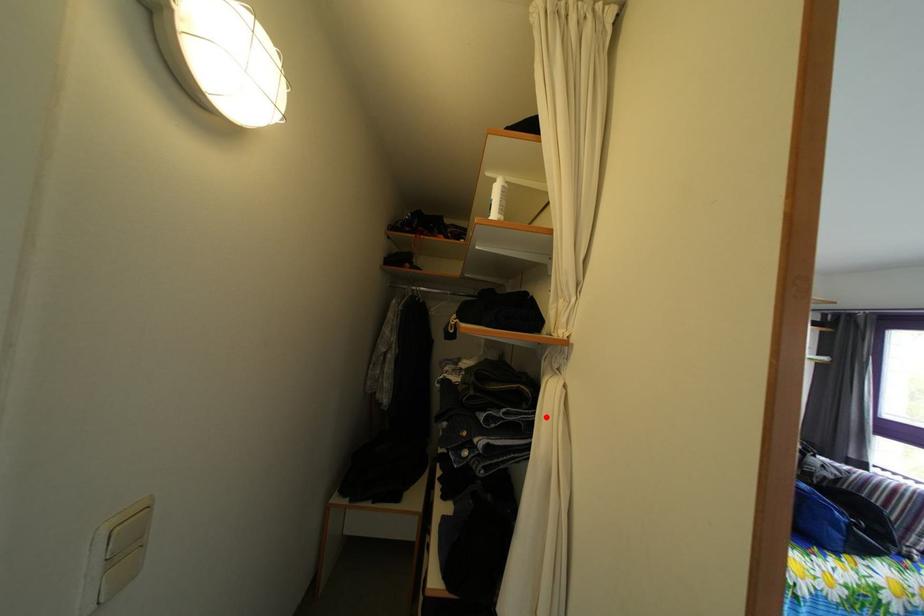
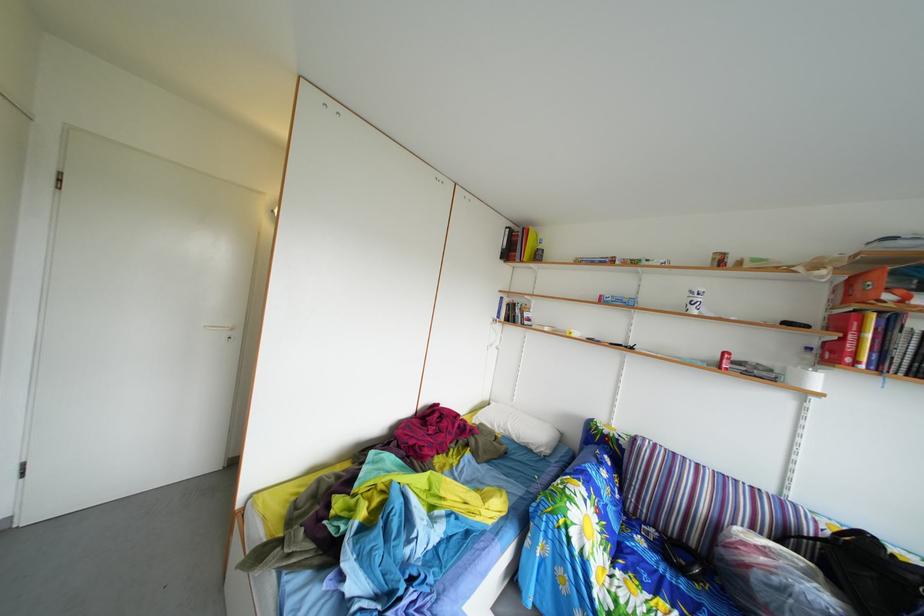
Question: I am providing you with two images of the same scene from different viewpoints. A red point is marked on the first image. At the location where the point appears in image 1, is it still visible in image 2?

Choices:
 (A) Yes
 (B) No

Answer: (B)